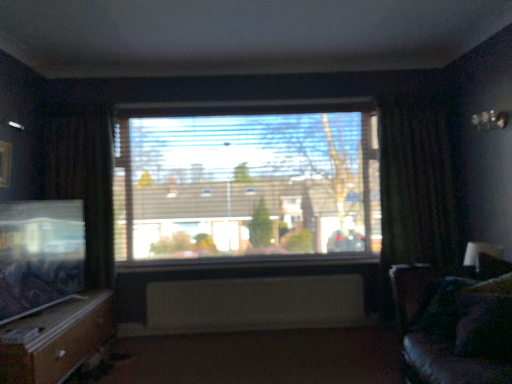
Locate an element on the screen. free region under white textured radiator at center (from a real-world perspective) is located at coordinates (250, 332).